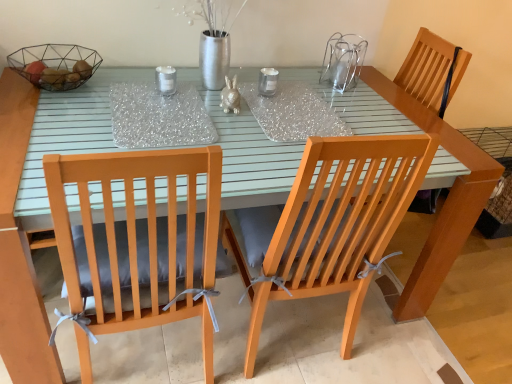
What is the approximate height of wooden chair with ribbons at center, placed as the 2th chair when sorted from left to right?

It is 38.00 inches.

Describe the element at coordinates (432, 70) in the screenshot. The image size is (512, 384). I see `wooden chair at right` at that location.

Locate an element on the screen. This screenshot has width=512, height=384. wooden chair with ribbons at center, marked as the first chair in a right-to-left arrangement is located at coordinates click(x=338, y=223).

Is wooden chair with ribbons at center, placed as the 2th chair when sorted from left to right, beside matte gray cushion at left, which appears as the 2th chair when viewed from the right?

No, wooden chair with ribbons at center, placed as the 2th chair when sorted from left to right, is not beside matte gray cushion at left, which appears as the 2th chair when viewed from the right.

Considering the relative sizes of wooden chair with ribbons at center, marked as the first chair in a right-to-left arrangement, and matte gray cushion at left, which appears as the 2th chair when viewed from the right, in the image provided, is wooden chair with ribbons at center, marked as the first chair in a right-to-left arrangement, smaller than matte gray cushion at left, which appears as the 2th chair when viewed from the right,?

No.

How many degrees apart are the facing directions of wooden chair with ribbons at center, marked as the first chair in a right-to-left arrangement, and matte gray cushion at left, marked as the first chair in a left-to-right arrangement?

The angular difference between wooden chair with ribbons at center, marked as the first chair in a right-to-left arrangement, and matte gray cushion at left, marked as the first chair in a left-to-right arrangement, is 0.000259 degrees.

Which object is wider, wooden chair with ribbons at center, placed as the 2th chair when sorted from left to right, or matte gray cushion at left, which appears as the 2th chair when viewed from the right?

Wider between the two is wooden chair with ribbons at center, placed as the 2th chair when sorted from left to right.

Is matte gray cushion at left, which appears as the 2th chair when viewed from the right, located outside wooden chair at right?

Yes.

Is matte gray cushion at left, which appears as the 2th chair when viewed from the right, taller than wooden chair at right?

Incorrect, the height of matte gray cushion at left, which appears as the 2th chair when viewed from the right, is not larger of that of wooden chair at right.

Could you measure the distance between matte gray cushion at left, marked as the first chair in a left-to-right arrangement, and wooden chair at right?

They are 4.12 feet apart.

The image size is (512, 384). What are the coordinates of `armchair above the matte gray cushion at left, marked as the first chair in a left-to-right arrangement (from a real-world perspective)` in the screenshot? It's located at (432, 70).

Considering the relative sizes of wooden chair at right and wooden chair with ribbons at center, placed as the 2th chair when sorted from left to right, in the image provided, is wooden chair at right wider than wooden chair with ribbons at center, placed as the 2th chair when sorted from left to right,?

No.

Is the depth of wooden chair at right less than that of wooden chair with ribbons at center, marked as the first chair in a right-to-left arrangement?

No, the depth of wooden chair at right is greater than that of wooden chair with ribbons at center, marked as the first chair in a right-to-left arrangement.

Considering the sizes of objects wooden chair at right and wooden chair with ribbons at center, marked as the first chair in a right-to-left arrangement, in the image provided, who is shorter, wooden chair at right or wooden chair with ribbons at center, marked as the first chair in a right-to-left arrangement,?

wooden chair at right is shorter.

Would you say wooden chair at right is to the left or to the right of wooden chair with ribbons at center, placed as the 2th chair when sorted from left to right, in the picture?

In the image, wooden chair at right appears on the right side of wooden chair with ribbons at center, placed as the 2th chair when sorted from left to right.

Is wooden chair at right next to matte gray cushion at left, marked as the first chair in a left-to-right arrangement, and touching it?

No, wooden chair at right is not touching matte gray cushion at left, marked as the first chair in a left-to-right arrangement.

Is point (434, 58) positioned after point (170, 213)?

Yes.

In terms of width, does wooden chair at right look wider or thinner when compared to matte gray cushion at left, which appears as the 2th chair when viewed from the right?

Clearly, wooden chair at right has more width compared to matte gray cushion at left, which appears as the 2th chair when viewed from the right.

The height and width of the screenshot is (384, 512). I want to click on armchair that is above the matte gray cushion at left, which appears as the 2th chair when viewed from the right (from a real-world perspective), so click(432, 70).

Which chair is the 2nd one when counting from the front of the wooden chair at right? Please provide its 2D coordinates.

[(338, 223)]

Is wooden chair at right surrounded by wooden chair with ribbons at center, marked as the first chair in a right-to-left arrangement?

Definitely not — wooden chair at right is not inside wooden chair with ribbons at center, marked as the first chair in a right-to-left arrangement.

Which is behind, point (321, 213) or point (433, 208)?

The point (433, 208) is more distant.

Is wooden chair with ribbons at center, placed as the 2th chair when sorted from left to right, shorter than wooden chair at right?

Incorrect, the height of wooden chair with ribbons at center, placed as the 2th chair when sorted from left to right, does not fall short of that of wooden chair at right.

What are the coordinates of `armchair that is on the right side of metallic wire basket at upper left` in the screenshot? It's located at (432, 70).

Considering the sizes of objects metallic wire basket at upper left and wooden chair at right in the image provided, who is smaller, metallic wire basket at upper left or wooden chair at right?

Smaller between the two is metallic wire basket at upper left.

Is metallic wire basket at upper left directly adjacent to wooden chair at right?

metallic wire basket at upper left is not next to wooden chair at right, and they're not touching.

Considering the relative positions of wooden chair with ribbons at center, marked as the first chair in a right-to-left arrangement, and metallic wire basket at upper left in the image provided, is wooden chair with ribbons at center, marked as the first chair in a right-to-left arrangement, to the left of metallic wire basket at upper left from the viewer's perspective?

No.

From a real-world perspective, relative to metallic wire basket at upper left, is wooden chair with ribbons at center, placed as the 2th chair when sorted from left to right, vertically above or below?

Clearly, from a real-world perspective, wooden chair with ribbons at center, placed as the 2th chair when sorted from left to right, is below metallic wire basket at upper left.

Is wooden chair with ribbons at center, placed as the 2th chair when sorted from left to right, far away from metallic wire basket at upper left?

No, wooden chair with ribbons at center, placed as the 2th chair when sorted from left to right, is not far away from metallic wire basket at upper left.

Does wooden chair with ribbons at center, marked as the first chair in a right-to-left arrangement, have a larger size compared to metallic wire basket at upper left?

Yes, wooden chair with ribbons at center, marked as the first chair in a right-to-left arrangement, is bigger than metallic wire basket at upper left.

At what (x,y) coordinates should I click in order to perform the action: click on chair located below the wooden chair with ribbons at center, placed as the 2th chair when sorted from left to right (from the image's perspective). Please return your answer as a coordinate pair (x, y). The image size is (512, 384). Looking at the image, I should click on (139, 238).

Identify the location of armchair on the right of matte gray cushion at left, which appears as the 2th chair when viewed from the right. The width and height of the screenshot is (512, 384). (432, 70).

Estimate the real-world distances between objects in this image. Which object is further from matte gray cushion at left, which appears as the 2th chair when viewed from the right, wooden chair with ribbons at center, placed as the 2th chair when sorted from left to right, or wooden chair at right?

wooden chair at right.

Looking at the image, which one is located further to wooden chair with ribbons at center, marked as the first chair in a right-to-left arrangement, wooden chair at right or matte gray cushion at left, which appears as the 2th chair when viewed from the right?

wooden chair at right is positioned further to the anchor wooden chair with ribbons at center, marked as the first chair in a right-to-left arrangement.

From the image, which object appears to be nearer to matte gray cushion at left, which appears as the 2th chair when viewed from the right, metallic wire basket at upper left or wooden chair at right?

metallic wire basket at upper left is positioned closer to the anchor matte gray cushion at left, which appears as the 2th chair when viewed from the right.

When comparing their distances from matte gray cushion at left, marked as the first chair in a left-to-right arrangement, does metallic wire basket at upper left or wooden chair with ribbons at center, placed as the 2th chair when sorted from left to right, seem further?

metallic wire basket at upper left is further to matte gray cushion at left, marked as the first chair in a left-to-right arrangement.

Which object lies further to the anchor point wooden chair with ribbons at center, marked as the first chair in a right-to-left arrangement, metallic wire basket at upper left or matte gray cushion at left, which appears as the 2th chair when viewed from the right?

metallic wire basket at upper left lies further to wooden chair with ribbons at center, marked as the first chair in a right-to-left arrangement, than the other object.

Which object lies nearer to the anchor point matte gray cushion at left, which appears as the 2th chair when viewed from the right, wooden chair at right or wooden chair with ribbons at center, placed as the 2th chair when sorted from left to right?

wooden chair with ribbons at center, placed as the 2th chair when sorted from left to right, lies closer to matte gray cushion at left, which appears as the 2th chair when viewed from the right, than the other object.

When comparing their distances from wooden chair with ribbons at center, marked as the first chair in a right-to-left arrangement, does wooden chair at right or metallic wire basket at upper left seem closer?

wooden chair at right lies closer to wooden chair with ribbons at center, marked as the first chair in a right-to-left arrangement, than the other object.

Consider the image. When comparing their distances from wooden chair at right, does wooden chair with ribbons at center, marked as the first chair in a right-to-left arrangement, or metallic wire basket at upper left seem further?

metallic wire basket at upper left is positioned further to the anchor wooden chair at right.

You are a GUI agent. You are given a task and a screenshot of the screen. Output one action in this format:
    pyautogui.click(x=<x>, y=<y>)
    Task: Click on the chair between matte gray cushion at left, marked as the first chair in a left-to-right arrangement, and wooden chair at right
    The width and height of the screenshot is (512, 384).
    Given the screenshot: What is the action you would take?
    pyautogui.click(x=338, y=223)

At what (x,y) coordinates should I click in order to perform the action: click on chair situated between metallic wire basket at upper left and wooden chair with ribbons at center, marked as the first chair in a right-to-left arrangement, from left to right. Please return your answer as a coordinate pair (x, y). The width and height of the screenshot is (512, 384). Looking at the image, I should click on (139, 238).